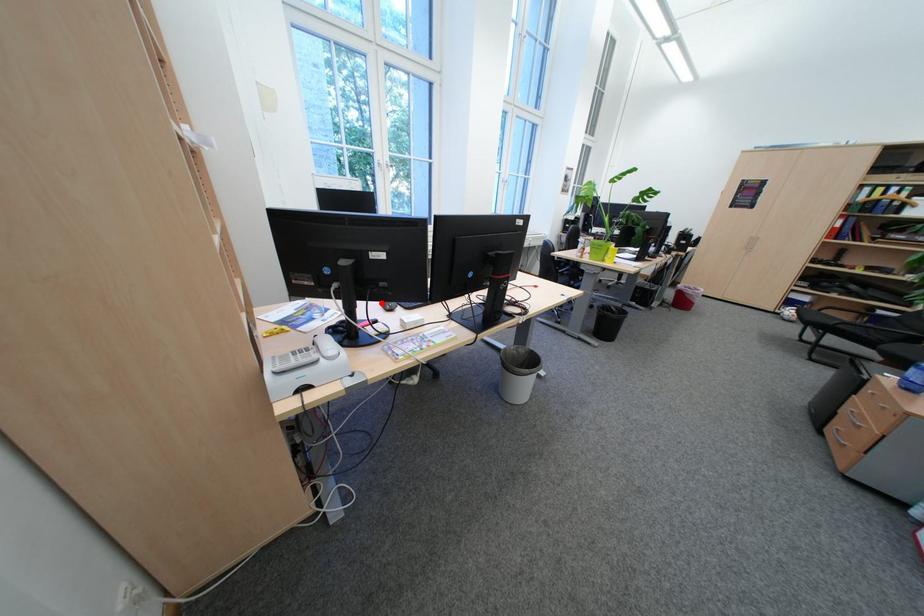
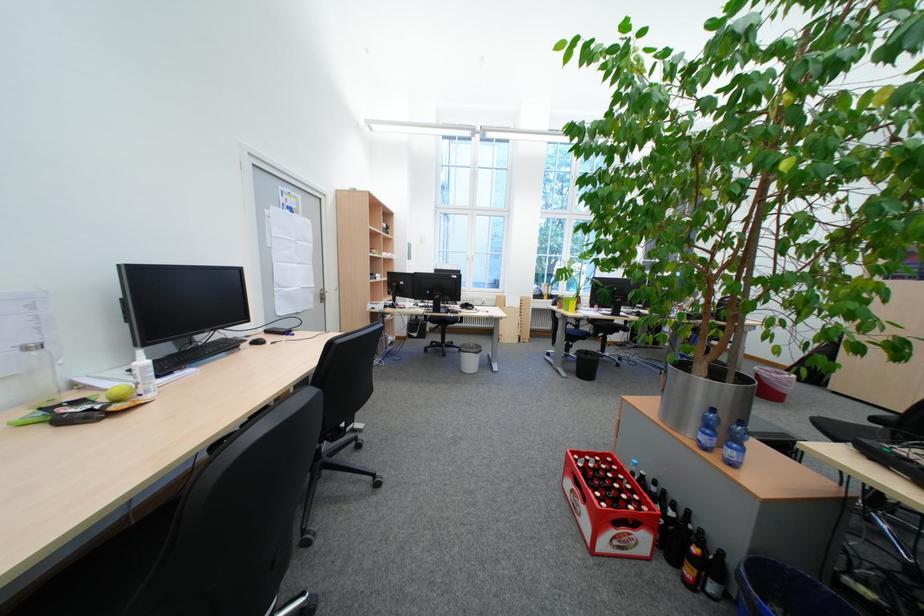
Question: I am providing you with two images of the same scene from different viewpoints. A red point is marked on the first image. Can you still see the location of the red point in image 2?

Choices:
 (A) Yes
 (B) No

Answer: (B)